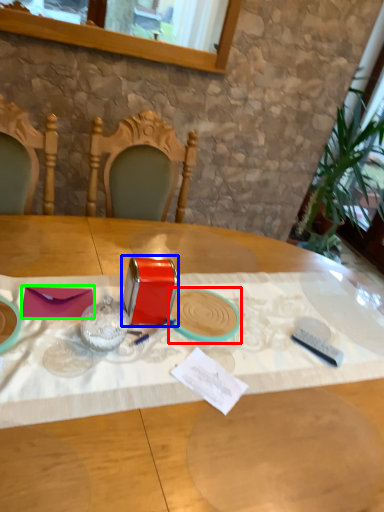
Question: Which is farther away from tableware (highlighted by a red box)? tableware (highlighted by a blue box) or notepad (highlighted by a green box)?

Choices:
 (A) tableware
 (B) notepad

Answer: (B)